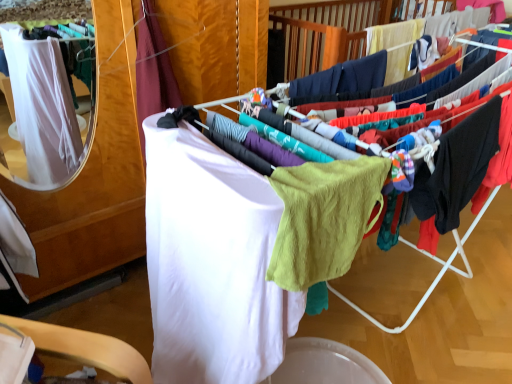
Question: Does black cotton hoodie at right, the 1th clothing in the right-to-left sequence, come in front of white fabric at left, the first clothing viewed from the left?

Choices:
 (A) no
 (B) yes

Answer: (B)

Question: Does black cotton hoodie at right, the 3th clothing in the left-to-right sequence, have a smaller size compared to white fabric at left, the first clothing viewed from the left?

Choices:
 (A) no
 (B) yes

Answer: (B)

Question: Considering the relative sizes of black cotton hoodie at right, the 3th clothing in the left-to-right sequence, and white fabric at left, the 3th clothing positioned from the right, in the image provided, is black cotton hoodie at right, the 3th clothing in the left-to-right sequence, taller than white fabric at left, the 3th clothing positioned from the right,?

Choices:
 (A) no
 (B) yes

Answer: (A)

Question: Is white fabric at left, the 3th clothing positioned from the right, located within black cotton hoodie at right, the 1th clothing in the right-to-left sequence?

Choices:
 (A) no
 (B) yes

Answer: (A)

Question: Is black cotton hoodie at right, the 1th clothing in the right-to-left sequence, oriented towards white fabric at left, the first clothing viewed from the left?

Choices:
 (A) no
 (B) yes

Answer: (A)

Question: Does black cotton hoodie at right, the 3th clothing in the left-to-right sequence, come behind white fabric at left, the 3th clothing positioned from the right?

Choices:
 (A) no
 (B) yes

Answer: (A)

Question: Is white fabric at left, the first clothing viewed from the left, outside of black cotton hoodie at right, the 3th clothing in the left-to-right sequence?

Choices:
 (A) yes
 (B) no

Answer: (A)

Question: From the image's perspective, is white fabric at left, the first clothing viewed from the left, on top of black cotton hoodie at right, the 1th clothing in the right-to-left sequence?

Choices:
 (A) no
 (B) yes

Answer: (B)

Question: Is white fabric at left, the first clothing viewed from the left, facing away from black cotton hoodie at right, the 1th clothing in the right-to-left sequence?

Choices:
 (A) no
 (B) yes

Answer: (A)

Question: Can you confirm if white fabric at left, the first clothing viewed from the left, is wider than black cotton hoodie at right, the 3th clothing in the left-to-right sequence?

Choices:
 (A) no
 (B) yes

Answer: (B)

Question: Is black cotton hoodie at right, the 1th clothing in the right-to-left sequence, surrounded by white fabric at left, the 3th clothing positioned from the right?

Choices:
 (A) no
 (B) yes

Answer: (A)

Question: Does white fabric at left, the first clothing viewed from the left, touch black cotton hoodie at right, the 1th clothing in the right-to-left sequence?

Choices:
 (A) yes
 (B) no

Answer: (B)

Question: Is black cotton hoodie at right, the 1th clothing in the right-to-left sequence, positioned with its back to lime green knit sweater at center?

Choices:
 (A) yes
 (B) no

Answer: (B)